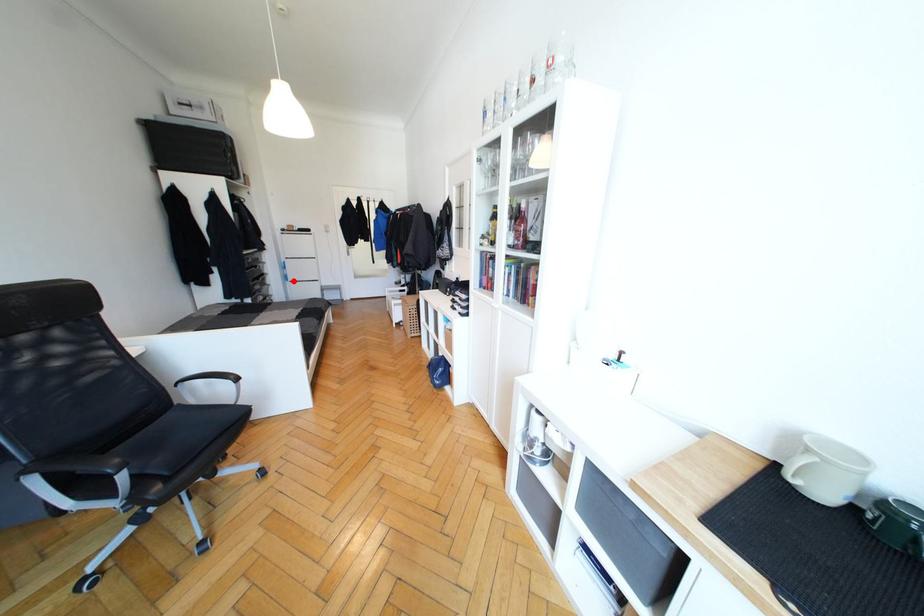
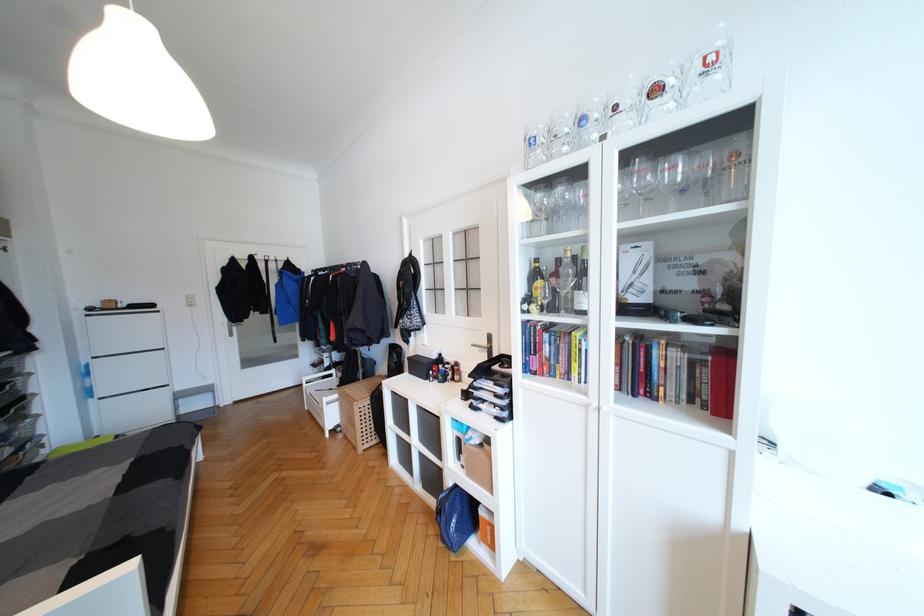
Question: I am providing you with two images of the same scene from different viewpoints. A red point is shown in image1. For the corresponding object point in image2, is it positioned nearer or farther from the camera?

Choices:
 (A) Nearer
 (B) Farther

Answer: (B)